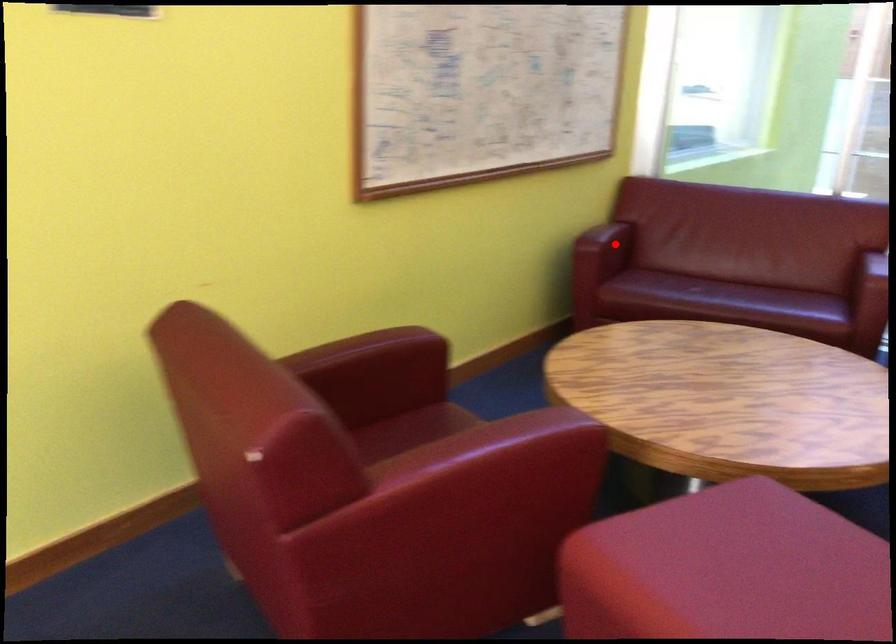
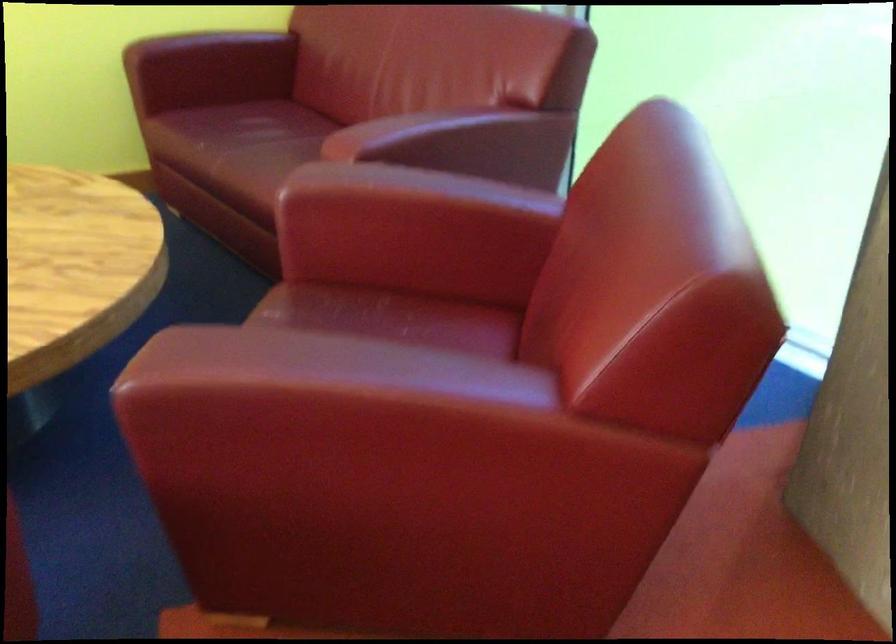
Question: A red point is marked in image1. In image2, is the corresponding 3D point closer to the camera or farther? Reply with the corresponding letter.

Choices:
 (A) The corresponding 3D point is closer.
 (B) The corresponding 3D point is farther.

Answer: (A)